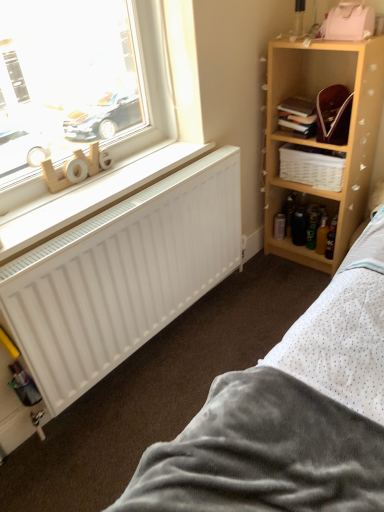
The width and height of the screenshot is (384, 512). Find the location of `free location above wooden letters at lower left (from a real-world perspective)`. free location above wooden letters at lower left (from a real-world perspective) is located at coordinates (94, 186).